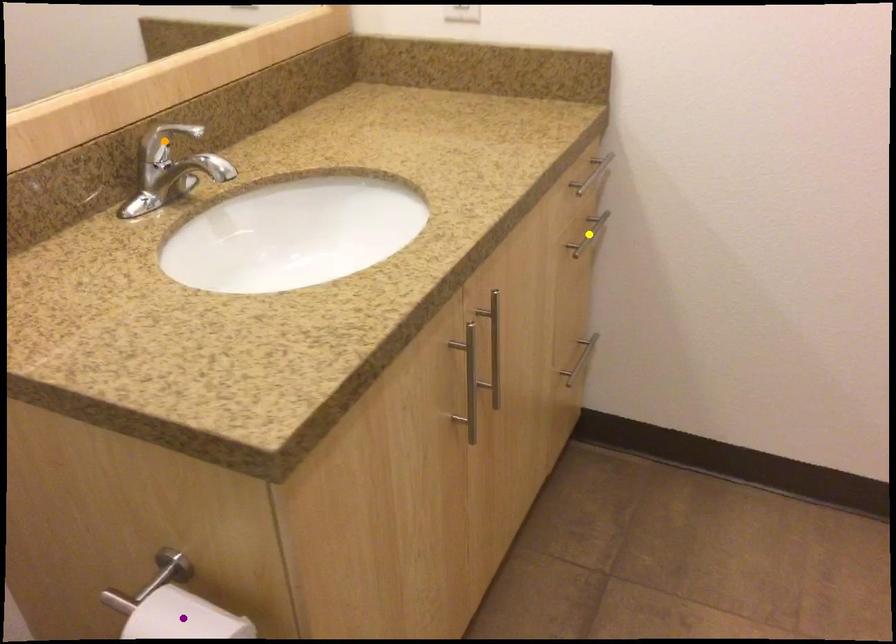
Order these from nearest to farthest:
purple point
yellow point
orange point

1. purple point
2. orange point
3. yellow point